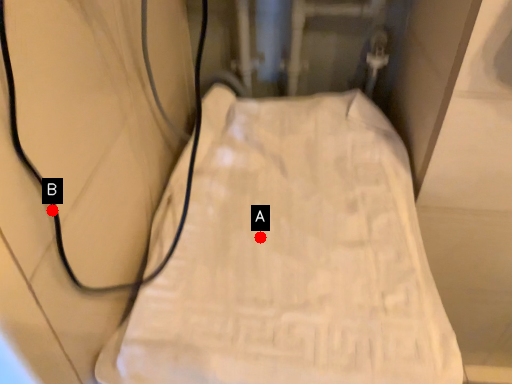
Question: Two points are circled on the image, labeled by A and B beside each circle. Which of the following is the closest to the observer?

Choices:
 (A) A is closer
 (B) B is closer

Answer: (B)